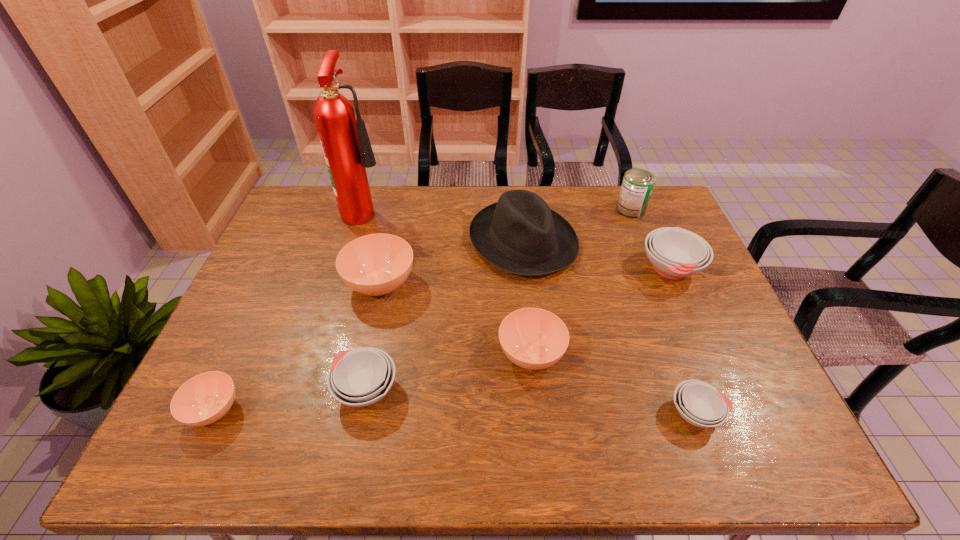
Locate an element on the screen. vacant region between the can and the leftmost white soup bowl is located at coordinates (498, 300).

The image size is (960, 540). In order to click on empty space between the smallest white soup bowl and the leftmost peach soup bowl in this screenshot , I will do `click(455, 411)`.

Identify the location of free space between the tallest object and the gray fedora. (444, 225).

Image resolution: width=960 pixels, height=540 pixels. I want to click on empty space that is in between the biggest white soup bowl and the biggest peach soup bowl, so click(x=526, y=276).

Locate an element on the screen. The height and width of the screenshot is (540, 960). vacant space in between the second smallest white soup bowl and the tallest object is located at coordinates (367, 300).

Identify which object is the third closest to the farthest white soup bowl. Please provide its 2D coordinates. Your answer should be formatted as a tuple, i.e. [(x, y)], where the tuple contains the x and y coordinates of a point satisfying the conditions above.

[(532, 338)]

Find the location of a particular element. The height and width of the screenshot is (540, 960). the eighth closest object relative to the farthest white soup bowl is located at coordinates (204, 399).

The width and height of the screenshot is (960, 540). I want to click on soup bowl that is the nearest to the fire extinguisher, so click(377, 264).

Image resolution: width=960 pixels, height=540 pixels. Find the location of `the fifth closest soup bowl relative to the farthest white soup bowl`. the fifth closest soup bowl relative to the farthest white soup bowl is located at coordinates (204, 399).

Find the location of a particular element. the third closest peach soup bowl to the leftmost white soup bowl is located at coordinates (532, 338).